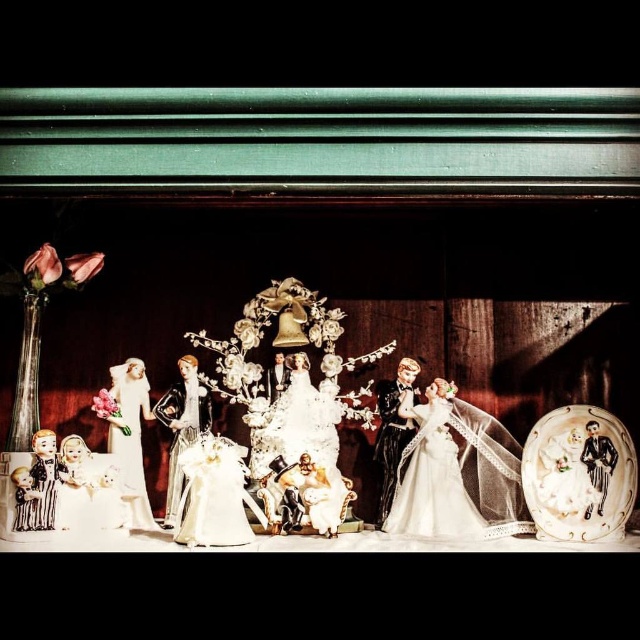
From the picture: You are a photographer setting up for a wedding photo shoot and need to position a spotlight on the white porcelain bride at left and the matte white dress at center. According to the scene, which object should you place the spotlight closer to the left side of the setup?

The white porcelain bride at left should be placed closer to the left side because the matte white dress at center is positioned to its right.

You are a guest at this wedding scene and want to give a gift to the bride. The gift is a small box that can only fit in the pocket of the white porcelain bride at left. However, you also have a larger decorative item that must be placed on the matte white dress at center. Based on their sizes, which item should go where?

The matte white dress at center is larger in size than the white porcelain bride at left. Therefore, the larger decorative item should be placed on the matte white dress at center, and the small box should go into the pocket of the white porcelain bride at left.

You are standing in front of the display and want to take a closer look at the matte white dress at center. If you can move forward 1.5 meters, will you be able to reach the dress?

The matte white dress at center is 1.91 meters away from you. Moving forward 1.5 meters would bring you to 0.41 meters away, so yes, you can reach it.